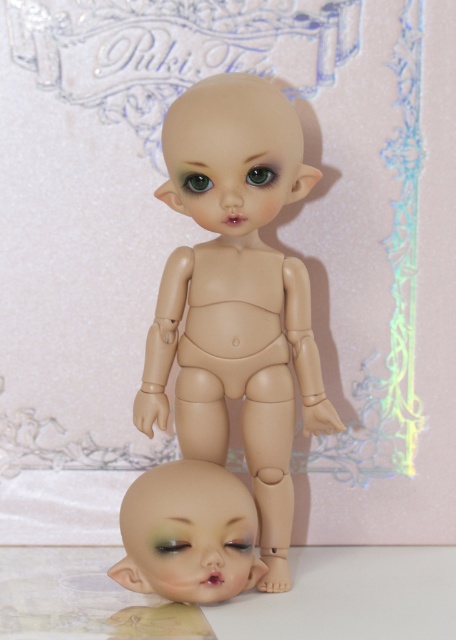
Based on the photo, can you confirm if matte beige doll at center is positioned below matte plastic head at lower center?

No.

Consider the image. Is matte beige doll at center behind matte plastic head at lower center?

Yes, it is behind matte plastic head at lower center.

I want to click on matte beige doll at center, so click(x=237, y=296).